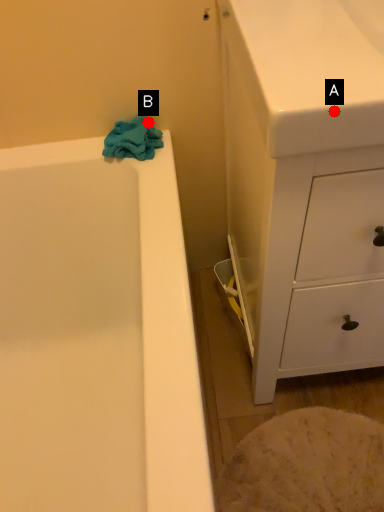
Question: Two points are circled on the image, labeled by A and B beside each circle. Which point is farther to the camera?

Choices:
 (A) A is further
 (B) B is further

Answer: (B)